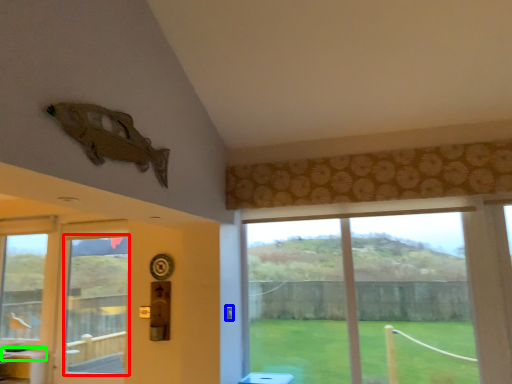
Question: Which object is the farthest from window screen (highlighted by a red box)? Choose among these: door handle (highlighted by a blue box) or counter top (highlighted by a green box).

Choices:
 (A) door handle
 (B) counter top

Answer: (A)